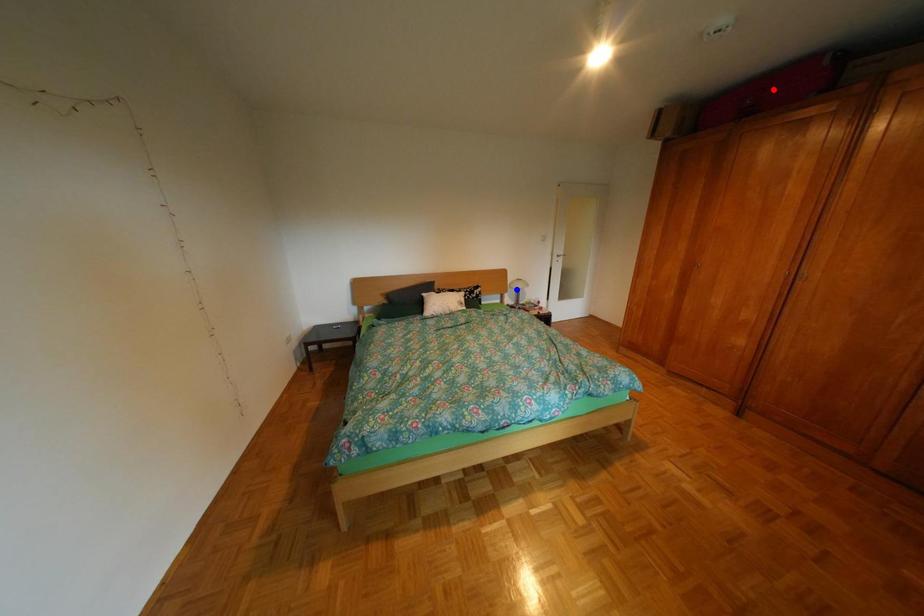
Question: In the image, two points are highlighted. Which point is nearer to the camera? Reply with the corresponding letter.

Choices:
 (A) blue point
 (B) red point

Answer: (B)